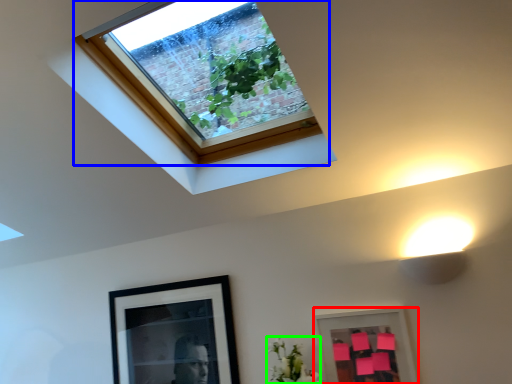
Question: Which object is the closest to the picture frame (highlighted by a red box)? Choose among these: window (highlighted by a blue box) or flower (highlighted by a green box).

Choices:
 (A) window
 (B) flower

Answer: (B)